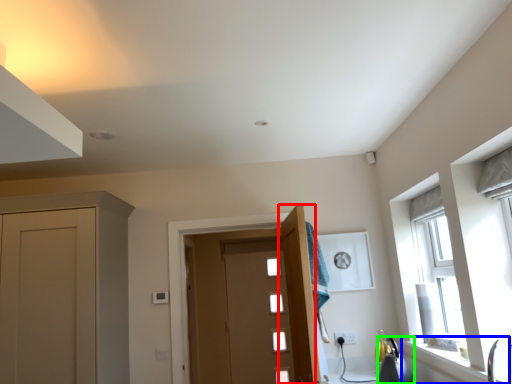
Question: Considering the real-world distances, which object is closest to door (highlighted by a red box)? window sill (highlighted by a blue box) or appliance (highlighted by a green box).

Choices:
 (A) window sill
 (B) appliance

Answer: (B)